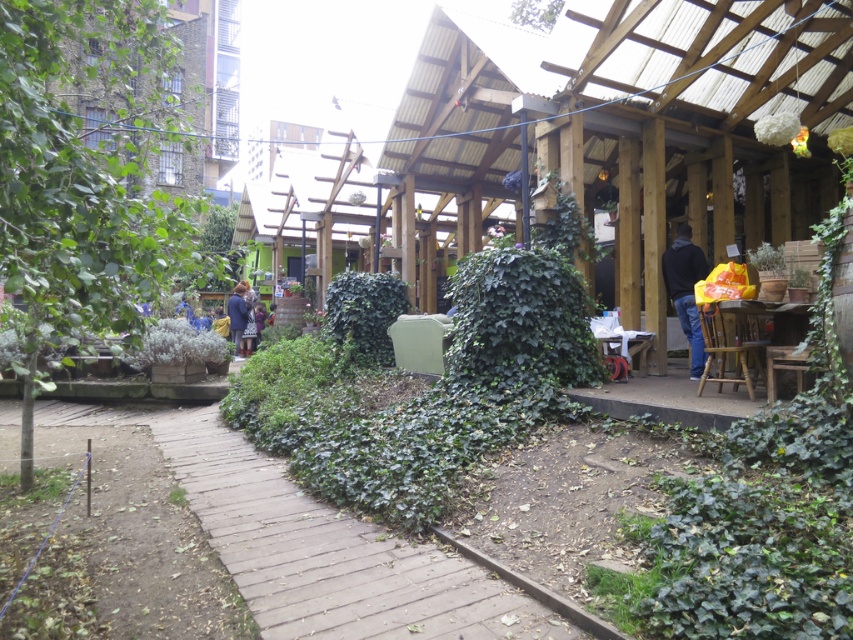
You are a photographer holding a camera and standing near the green leafy bush at left. You want to take a photo of the wooden pergola with hanging white spherical lights on the right. To ensure the camera can capture the entire pergola in the frame, you need to be at least 2.5 meters away from it. Are you currently far enough away?

The green leafy bush at left and camera are 2.17 meters apart from each other. Since the required distance is 2.5 meters, you are not far enough away to capture the entire pergola in the frame.